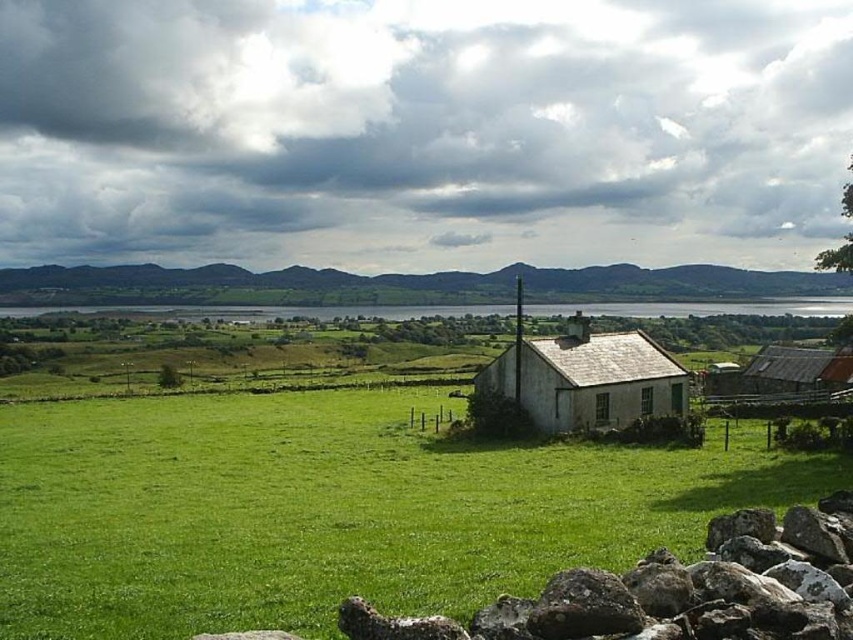
Question: Is green grassy field at center positioned at the back of rough textured rock at lower right?

Choices:
 (A) no
 (B) yes

Answer: (B)

Question: Which point is farther from the camera taking this photo?

Choices:
 (A) 613,401
 (B) 390,522
 (C) 741,598

Answer: (A)

Question: Can you confirm if green grassy field at center is positioned above white textured house at center?

Choices:
 (A) no
 (B) yes

Answer: (A)

Question: Which point appears farthest from the camera in this image?

Choices:
 (A) (653, 449)
 (B) (619, 413)

Answer: (B)

Question: Can you confirm if green grassy field at center is bigger than rough textured rock at lower right?

Choices:
 (A) no
 (B) yes

Answer: (B)

Question: Which of the following is the closest to the observer?

Choices:
 (A) (486, 390)
 (B) (692, 637)

Answer: (B)